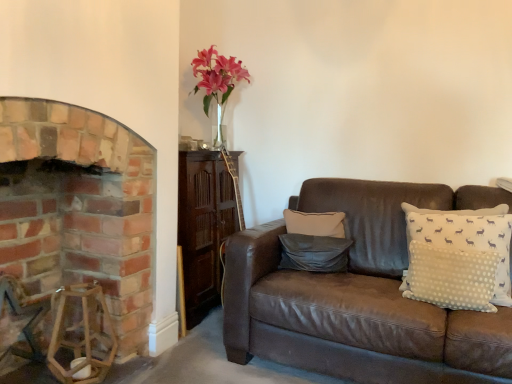
Question: Does dark gray leather pillow at center, which appears as the 2th pillow when viewed from the right, have a greater width compared to brick fireplace at left?

Choices:
 (A) yes
 (B) no

Answer: (B)

Question: Does dark gray leather pillow at center, which is the 1th pillow in left-to-right order, have a greater height compared to brick fireplace at left?

Choices:
 (A) yes
 (B) no

Answer: (B)

Question: Is dark gray leather pillow at center, which appears as the 2th pillow when viewed from the right, positioned beyond the bounds of brick fireplace at left?

Choices:
 (A) yes
 (B) no

Answer: (A)

Question: Considering the relative positions of dark gray leather pillow at center, which appears as the 2th pillow when viewed from the right, and brick fireplace at left in the image provided, is dark gray leather pillow at center, which appears as the 2th pillow when viewed from the right, to the left of brick fireplace at left from the viewer's perspective?

Choices:
 (A) no
 (B) yes

Answer: (A)

Question: From the image's perspective, does dark gray leather pillow at center, which appears as the 2th pillow when viewed from the right, appear lower than brick fireplace at left?

Choices:
 (A) no
 (B) yes

Answer: (B)

Question: Is dark gray leather pillow at center, which appears as the 2th pillow when viewed from the right, inside or outside of pink glass vase at upper center?

Choices:
 (A) outside
 (B) inside

Answer: (A)

Question: Is dark gray leather pillow at center, which is the 1th pillow in left-to-right order, wider or thinner than pink glass vase at upper center?

Choices:
 (A) thin
 (B) wide

Answer: (A)

Question: From the image's perspective, is dark gray leather pillow at center, which appears as the 2th pillow when viewed from the right, positioned above or below pink glass vase at upper center?

Choices:
 (A) above
 (B) below

Answer: (B)

Question: Visually, is dark gray leather pillow at center, which is the 1th pillow in left-to-right order, positioned to the left or to the right of pink glass vase at upper center?

Choices:
 (A) right
 (B) left

Answer: (A)

Question: Considering the positions of pink glass vase at upper center and dark gray leather pillow at center, which is the 1th pillow in left-to-right order, in the image, is pink glass vase at upper center bigger or smaller than dark gray leather pillow at center, which is the 1th pillow in left-to-right order,?

Choices:
 (A) small
 (B) big

Answer: (B)

Question: From a real-world perspective, is pink glass vase at upper center above or below dark gray leather pillow at center, which appears as the 2th pillow when viewed from the right?

Choices:
 (A) above
 (B) below

Answer: (A)

Question: Considering the positions of pink glass vase at upper center and dark gray leather pillow at center, which is the 1th pillow in left-to-right order, in the image, is pink glass vase at upper center taller or shorter than dark gray leather pillow at center, which is the 1th pillow in left-to-right order,?

Choices:
 (A) tall
 (B) short

Answer: (A)

Question: Does point (227, 72) appear closer or farther from the camera than point (315, 263)?

Choices:
 (A) closer
 (B) farther

Answer: (B)

Question: Based on their sizes in the image, would you say brick fireplace at left is bigger or smaller than pink glass vase at upper center?

Choices:
 (A) big
 (B) small

Answer: (A)

Question: In terms of height, does brick fireplace at left look taller or shorter compared to pink glass vase at upper center?

Choices:
 (A) tall
 (B) short

Answer: (A)